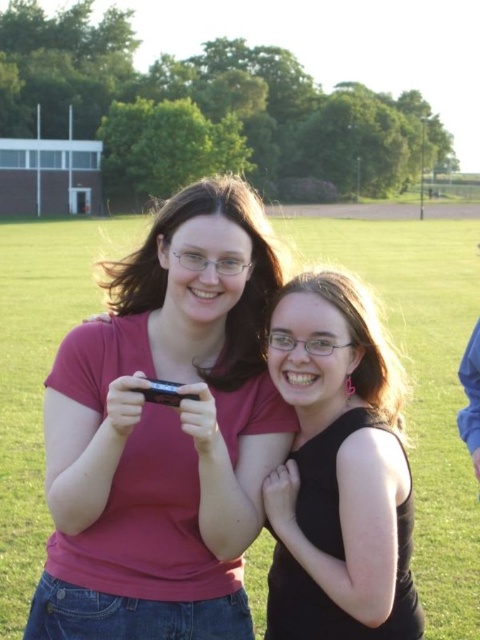
Question: Which object is closer to the camera taking this photo?

Choices:
 (A) black matte tank top at center
 (B) matte pink shirt at center

Answer: (B)

Question: Does matte pink shirt at center have a lesser width compared to black matte tank top at center?

Choices:
 (A) yes
 (B) no

Answer: (B)

Question: Does matte pink shirt at center have a lesser width compared to black matte tank top at center?

Choices:
 (A) no
 (B) yes

Answer: (A)

Question: Which object appears closest to the camera in this image?

Choices:
 (A) matte pink shirt at center
 (B) black matte tank top at center

Answer: (A)

Question: Does matte pink shirt at center come in front of black matte tank top at center?

Choices:
 (A) no
 (B) yes

Answer: (B)